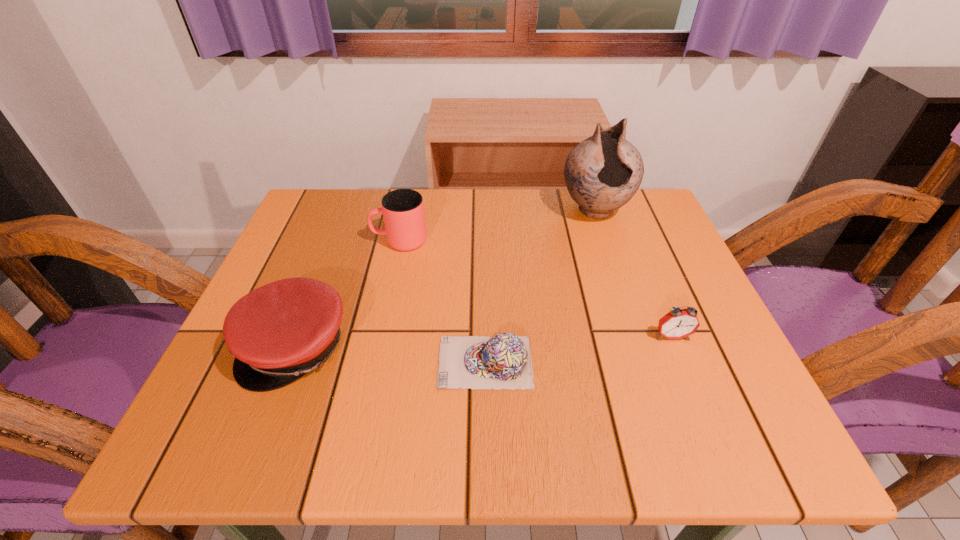
At what (x,y) coordinates should I click in order to perform the action: click on vacant space located 0.280m on the front, side, and top of the right cap. Please return your answer as a coordinate pair (x, y). Looking at the image, I should click on [279, 362].

At what (x,y) coordinates should I click in order to perform the action: click on vacant region located 0.120m on the front, side, and top of the right cap. Please return your answer as a coordinate pair (x, y). Looking at the image, I should click on (371, 362).

The height and width of the screenshot is (540, 960). I want to click on vacant point located 0.270m on the front, side, and top of the right cap, so click(x=285, y=362).

Locate an element on the screen. This screenshot has height=540, width=960. pottery located at the far edge is located at coordinates (602, 173).

Where is `cup present at the far edge`? The image size is (960, 540). cup present at the far edge is located at coordinates (403, 209).

You are a GUI agent. You are given a task and a screenshot of the screen. Output one action in this format:
    pyautogui.click(x=<x>, y=<y>)
    Task: Click on the object that is at the left edge
    Image resolution: width=960 pixels, height=540 pixels.
    Given the screenshot: What is the action you would take?
    pyautogui.click(x=277, y=333)

This screenshot has width=960, height=540. I want to click on pottery that is at the right edge, so click(x=602, y=173).

The width and height of the screenshot is (960, 540). Find the location of `alarm clock situated at the right edge`. alarm clock situated at the right edge is located at coordinates [679, 323].

Identify the location of object that is positioned at the far right corner. The width and height of the screenshot is (960, 540). [x=602, y=173].

Locate an element on the screen. The width and height of the screenshot is (960, 540). free space at the far edge of the desktop is located at coordinates (440, 228).